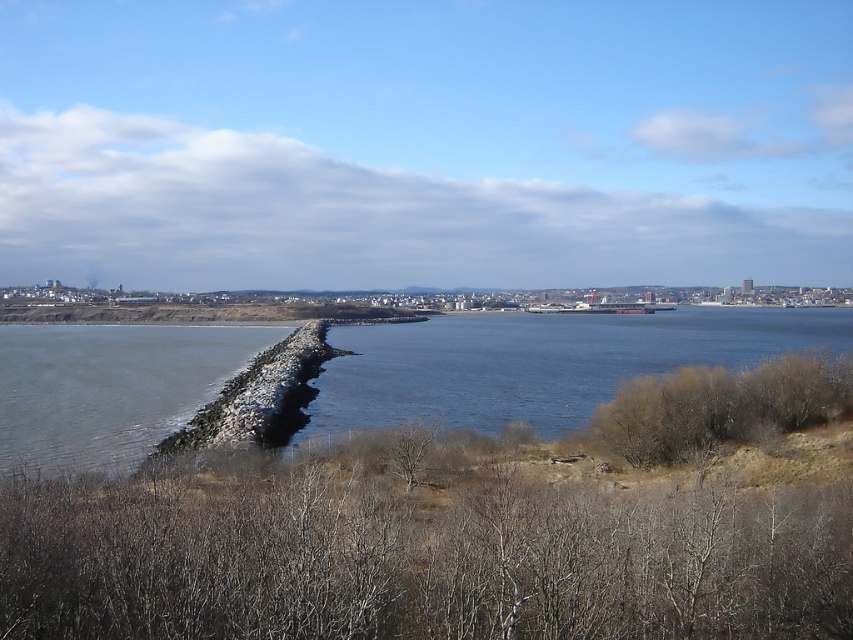
You are standing at the edge of the coastal scene and want to walk to the rocky jetty at lower left. Based on the description, can you estimate how far you need to walk to reach it?

The rocky jetty at lower left is 21.49 meters away from the viewer, so you need to walk approximately 21.49 meters to reach it.

You are a photographer standing at the edge of the dark gray concrete waterway at center and want to take a photo of the rocky jetty at lower left. Which object is closer to you, the photographer?

The dark gray concrete waterway at center is closer to you, the photographer, since it is further to the viewer than the rocky jetty at lower left, meaning the rocky jetty is farther away.